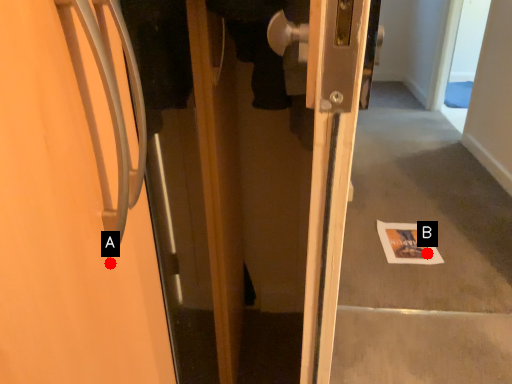
Question: Two points are circled on the image, labeled by A and B beside each circle. Which point is farther to the camera?

Choices:
 (A) A is further
 (B) B is further

Answer: (B)